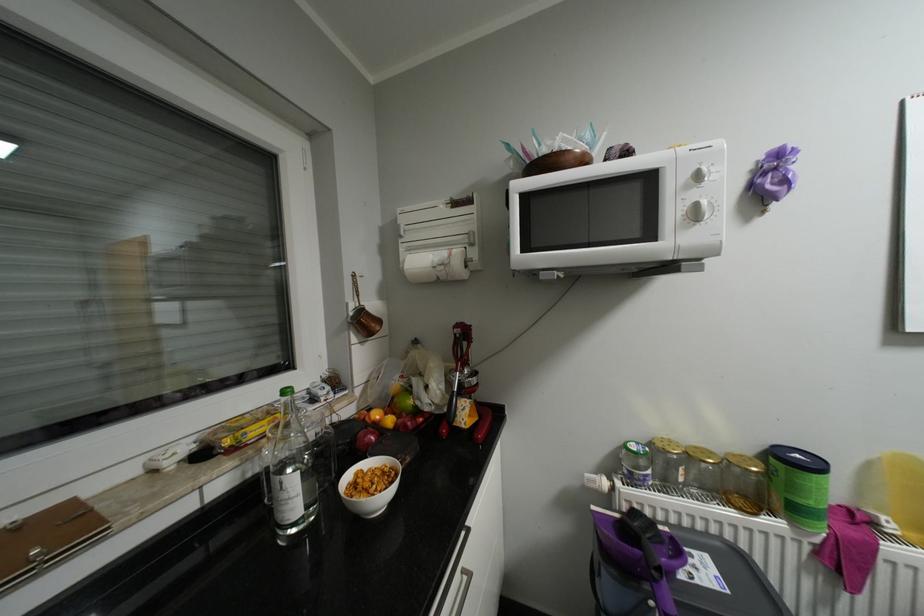
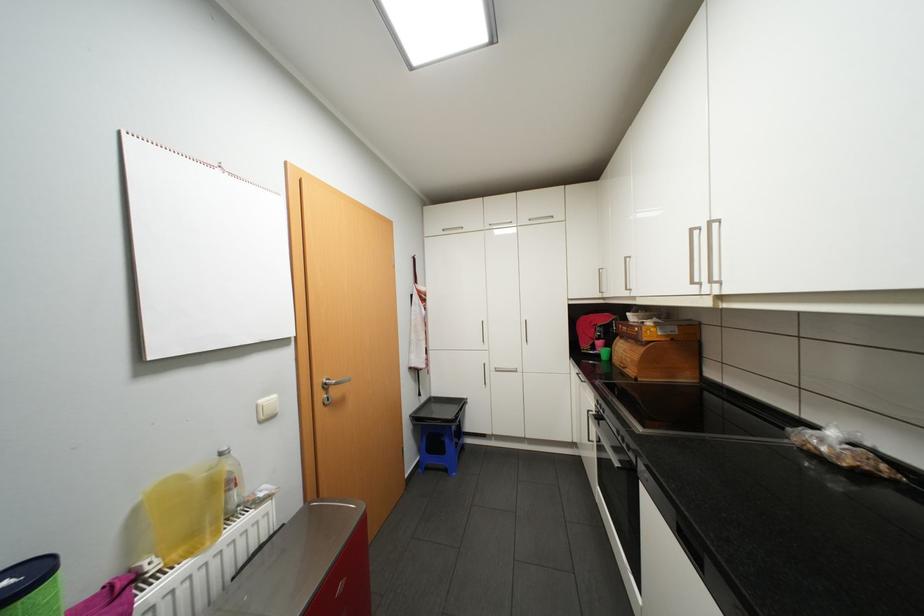
Question: The camera is either moving clockwise (left) or counter-clockwise (right) around the object. The first image is from the beginning of the video and the second image is from the end. Is the camera moving left or right when shooting the video?

Choices:
 (A) Left
 (B) Right

Answer: (A)